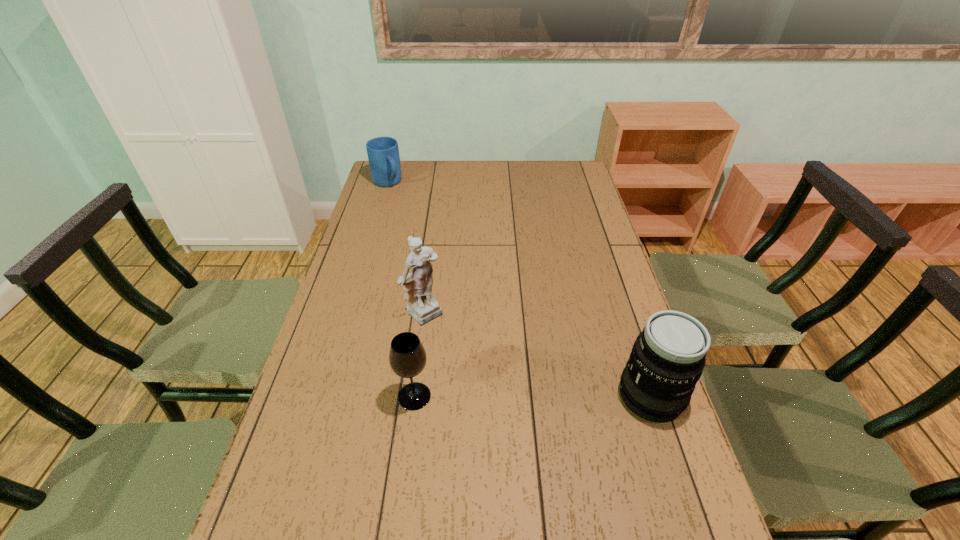
Identify the location of vacant space situated on the front-facing side of the second farthest object. (483, 359).

You are a GUI agent. You are given a task and a screenshot of the screen. Output one action in this format:
    pyautogui.click(x=<x>, y=<y>)
    Task: Click on the free spot located on the side of the mug with the handle
    Image resolution: width=960 pixels, height=540 pixels.
    Given the screenshot: What is the action you would take?
    pyautogui.click(x=434, y=244)

Identify the location of vacant space located on the side of the mug with the handle. (412, 216).

Where is `free region located 0.330m on the side of the mug with the handle`? This screenshot has height=540, width=960. free region located 0.330m on the side of the mug with the handle is located at coordinates (426, 233).

The image size is (960, 540). In order to click on object situated at the far edge in this screenshot , I will do `click(383, 153)`.

Where is `object that is at the left edge`? This screenshot has width=960, height=540. object that is at the left edge is located at coordinates (383, 153).

The image size is (960, 540). What are the coordinates of `object at the right edge` in the screenshot? It's located at (668, 357).

Find the location of `object located in the far left corner section of the desktop`. object located in the far left corner section of the desktop is located at coordinates (383, 153).

In the image, there is a desktop. Identify the location of vacant space at the far edge. (530, 162).

Locate an element on the screen. The image size is (960, 540). vacant area at the near edge of the desktop is located at coordinates (391, 498).